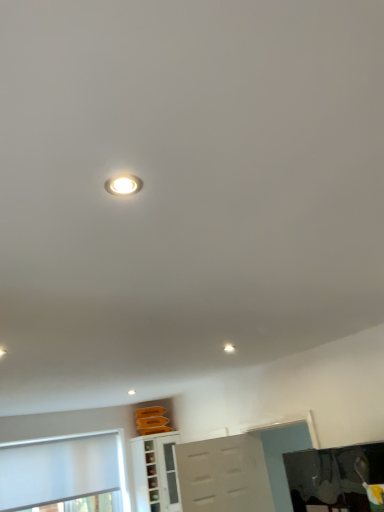
Question: From a real-world perspective, is white matte window at lower left physically above white glossy cabinet at lower center?

Choices:
 (A) no
 (B) yes

Answer: (B)

Question: Is the depth of white matte window at lower left less than that of white glossy cabinet at lower center?

Choices:
 (A) no
 (B) yes

Answer: (B)

Question: Could you tell me if white matte window at lower left is turned towards white glossy cabinet at lower center?

Choices:
 (A) no
 (B) yes

Answer: (A)

Question: Does white matte window at lower left have a larger size compared to white glossy cabinet at lower center?

Choices:
 (A) yes
 (B) no

Answer: (B)

Question: Is white glossy cabinet at lower center at the back of white matte window at lower left?

Choices:
 (A) yes
 (B) no

Answer: (B)

Question: From the image's perspective, relative to white matte window at lower left, is white glossy cabinet at lower center above or below?

Choices:
 (A) below
 (B) above

Answer: (A)

Question: Is point (144, 490) closer or farther from the camera than point (82, 482)?

Choices:
 (A) closer
 (B) farther

Answer: (B)

Question: Is white glossy cabinet at lower center wider or thinner than white matte window at lower left?

Choices:
 (A) thin
 (B) wide

Answer: (B)

Question: Considering the positions of white glossy cabinet at lower center and white matte window at lower left in the image, is white glossy cabinet at lower center bigger or smaller than white matte window at lower left?

Choices:
 (A) big
 (B) small

Answer: (A)

Question: Considering the relative positions of white glossy droplight at center and white glossy cabinet at lower center in the image provided, is white glossy droplight at center to the left or to the right of white glossy cabinet at lower center?

Choices:
 (A) right
 (B) left

Answer: (A)

Question: Is white glossy droplight at center in front of or behind white glossy cabinet at lower center in the image?

Choices:
 (A) behind
 (B) front

Answer: (B)

Question: From a real-world perspective, is white glossy droplight at center positioned above or below white glossy cabinet at lower center?

Choices:
 (A) below
 (B) above

Answer: (B)

Question: Considering the positions of point (228, 348) and point (142, 454), is point (228, 348) closer or farther from the camera than point (142, 454)?

Choices:
 (A) closer
 (B) farther

Answer: (A)

Question: From their relative heights in the image, would you say white glossy cabinet at lower center is taller or shorter than white glossy droplight at center?

Choices:
 (A) tall
 (B) short

Answer: (A)

Question: From a real-world perspective, is white glossy cabinet at lower center physically located above or below white glossy droplight at center?

Choices:
 (A) above
 (B) below

Answer: (B)